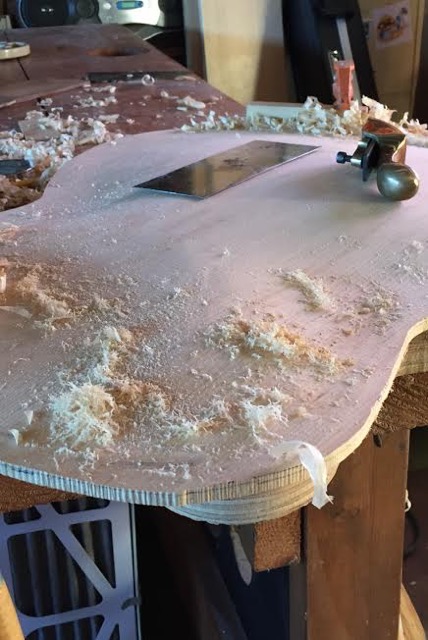
This screenshot has width=428, height=640. Find the location of `hourglass shaped wood piece`. hourglass shaped wood piece is located at coordinates (240, 235).